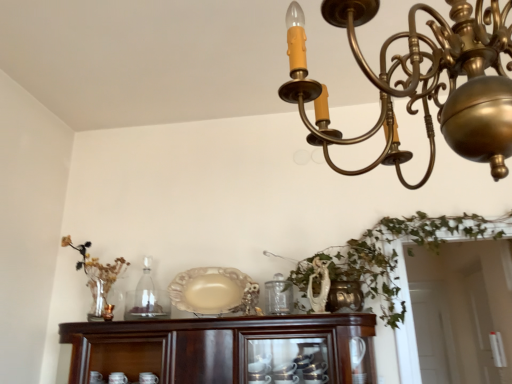
Question: Is gold metallic chandelier at upper center far away from clear glass bottle at center?

Choices:
 (A) no
 (B) yes

Answer: (B)

Question: Does gold metallic chandelier at upper center appear on the right side of clear glass bottle at center?

Choices:
 (A) no
 (B) yes

Answer: (B)

Question: Does gold metallic chandelier at upper center have a larger size compared to clear glass bottle at center?

Choices:
 (A) yes
 (B) no

Answer: (A)

Question: Is clear glass bottle at center at the back of gold metallic chandelier at upper center?

Choices:
 (A) no
 (B) yes

Answer: (A)

Question: Is the depth of gold metallic chandelier at upper center less than that of clear glass bottle at center?

Choices:
 (A) no
 (B) yes

Answer: (B)

Question: Considering the relative sizes of gold metallic chandelier at upper center and clear glass bottle at center in the image provided, is gold metallic chandelier at upper center smaller than clear glass bottle at center?

Choices:
 (A) no
 (B) yes

Answer: (A)

Question: From a real-world perspective, does clear glass bottle at center stand above mahogany wood cabinet at lower center?

Choices:
 (A) yes
 (B) no

Answer: (A)

Question: Is clear glass bottle at center to the right of mahogany wood cabinet at lower center from the viewer's perspective?

Choices:
 (A) yes
 (B) no

Answer: (B)

Question: Is clear glass bottle at center aimed at mahogany wood cabinet at lower center?

Choices:
 (A) yes
 (B) no

Answer: (B)

Question: Does clear glass bottle at center have a greater height compared to mahogany wood cabinet at lower center?

Choices:
 (A) no
 (B) yes

Answer: (B)

Question: Does clear glass bottle at center appear on the left side of mahogany wood cabinet at lower center?

Choices:
 (A) no
 (B) yes

Answer: (B)

Question: Is clear glass bottle at center further to camera compared to mahogany wood cabinet at lower center?

Choices:
 (A) no
 (B) yes

Answer: (B)

Question: Does clear glass bottle at center have a lesser height compared to matte gold candle holder at left?

Choices:
 (A) yes
 (B) no

Answer: (B)